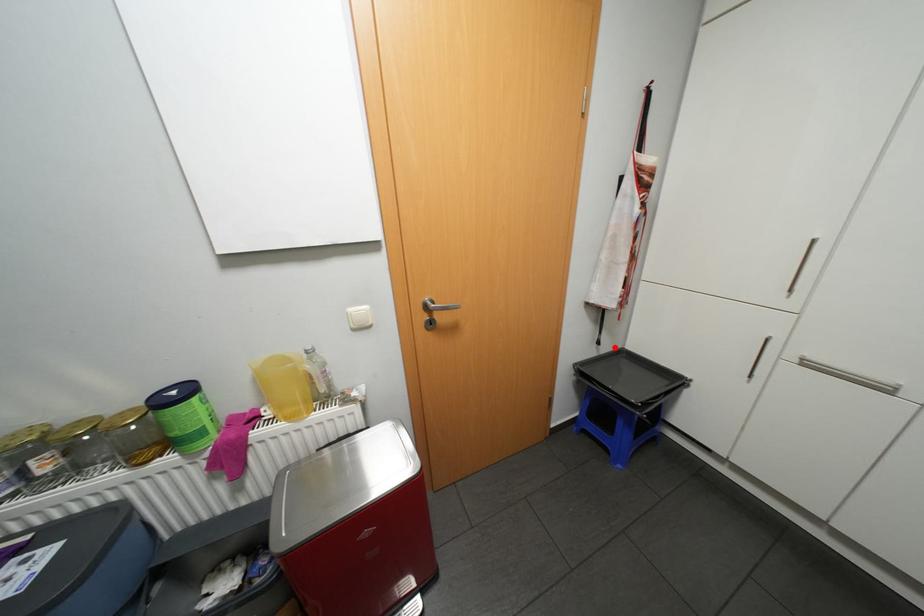
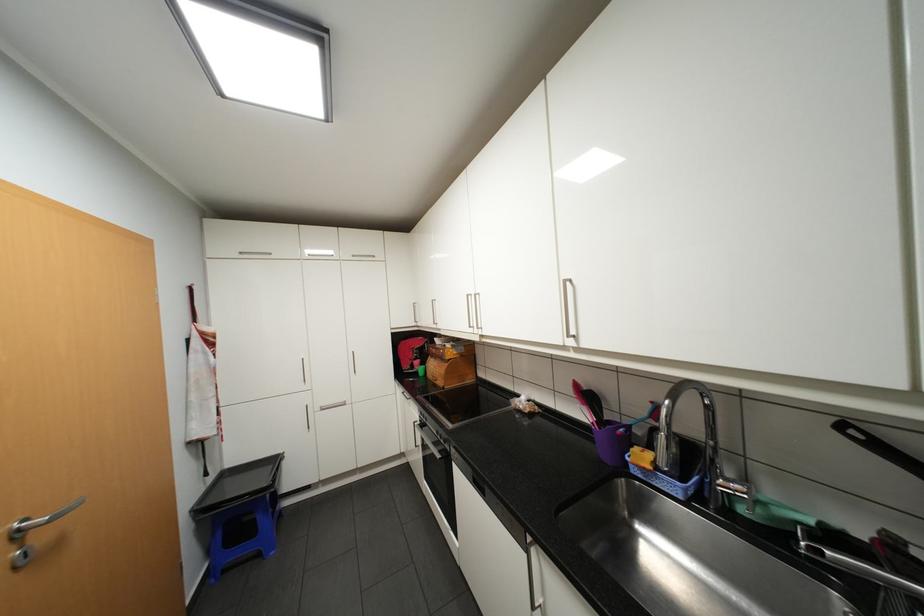
Locate, in the second image, the point that corresponds to the highlighted location in the first image.

(220, 476)